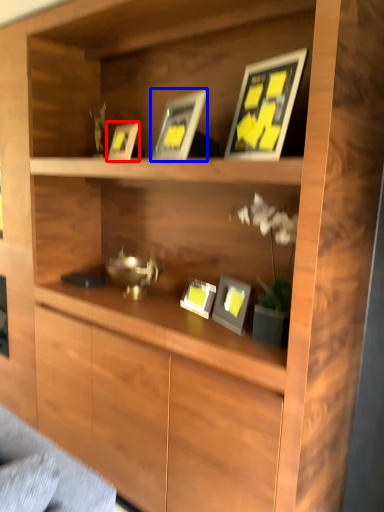
Question: Which object appears closest to the camera in this image, picture frame (highlighted by a red box) or picture frame (highlighted by a blue box)?

Choices:
 (A) picture frame
 (B) picture frame

Answer: (B)